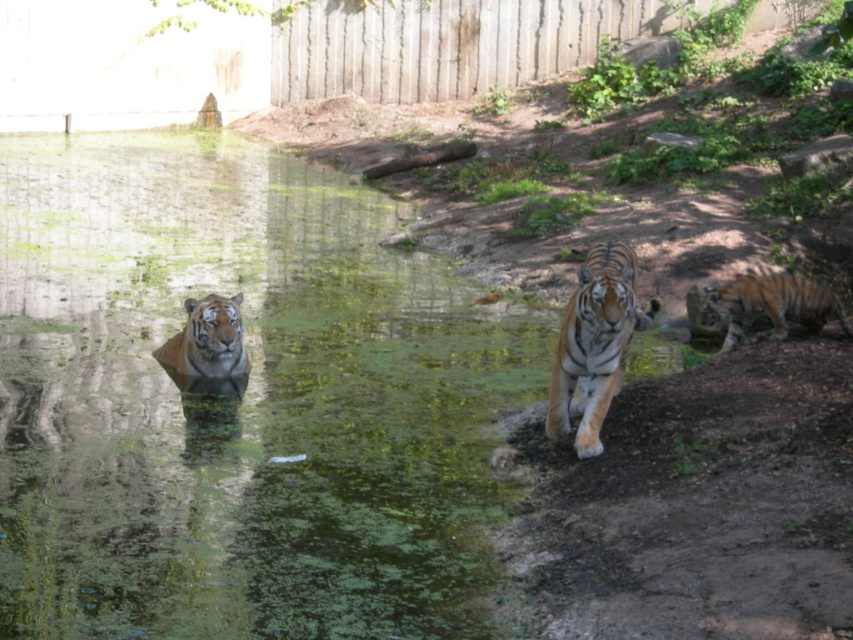
Does point (622, 298) come in front of point (722, 346)?

Yes, it is in front of point (722, 346).

Can you confirm if orange striped tiger at center is smaller than orange striped tiger at right?

Yes, orange striped tiger at center is smaller than orange striped tiger at right.

Which is behind, point (606, 246) or point (804, 308)?

The point (804, 308) is behind.

The width and height of the screenshot is (853, 640). In order to click on orange striped tiger at center in this screenshot , I will do `click(595, 344)`.

Consider the image. Is orange striped tiger at center shorter than orange striped tiger at left?

In fact, orange striped tiger at center may be taller than orange striped tiger at left.

Who is positioned more to the left, orange striped tiger at center or orange striped tiger at left?

From the viewer's perspective, orange striped tiger at left appears more on the left side.

Where is `orange striped tiger at center`? orange striped tiger at center is located at coordinates (595, 344).

This screenshot has width=853, height=640. Describe the element at coordinates (770, 305) in the screenshot. I see `orange striped tiger at right` at that location.

Between point (769, 314) and point (173, 333), which one is positioned in front?

Point (769, 314)

Where is `orange striped tiger at right`? The width and height of the screenshot is (853, 640). orange striped tiger at right is located at coordinates pyautogui.click(x=770, y=305).